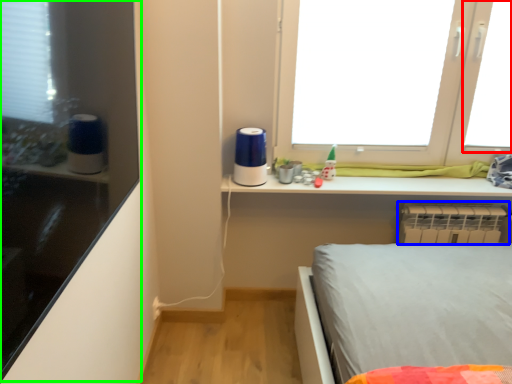
Question: Which object is the closest to the window screen (highlighted by a red box)? Choose among these: radiator (highlighted by a blue box) or shelf (highlighted by a green box).

Choices:
 (A) radiator
 (B) shelf

Answer: (A)